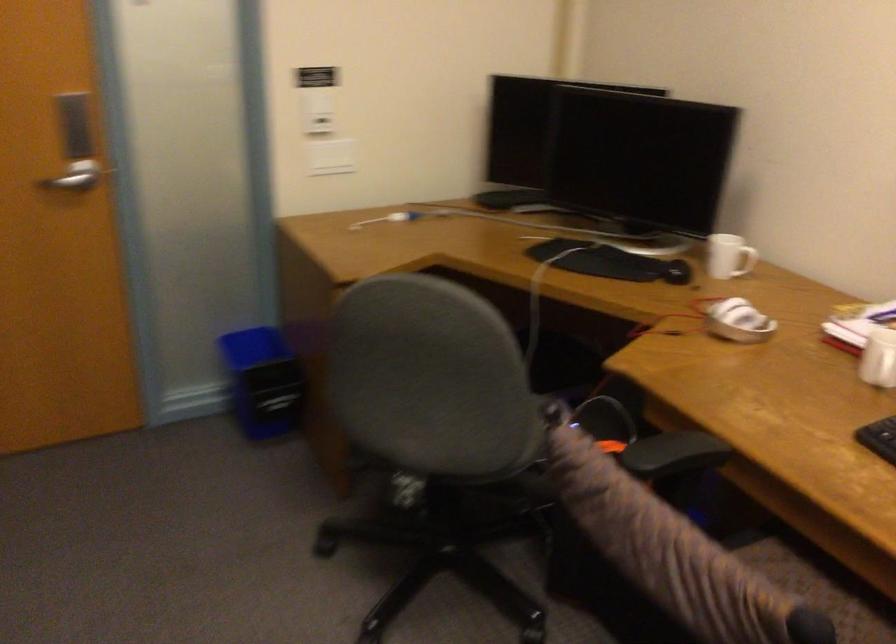
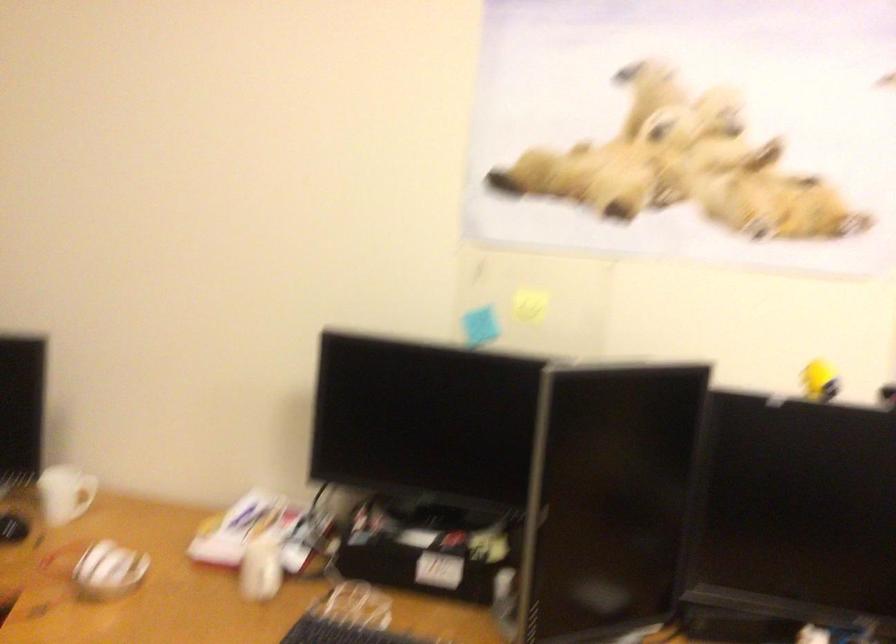
Find the pixel in the second image that matches (739,252) in the first image.

(83, 495)